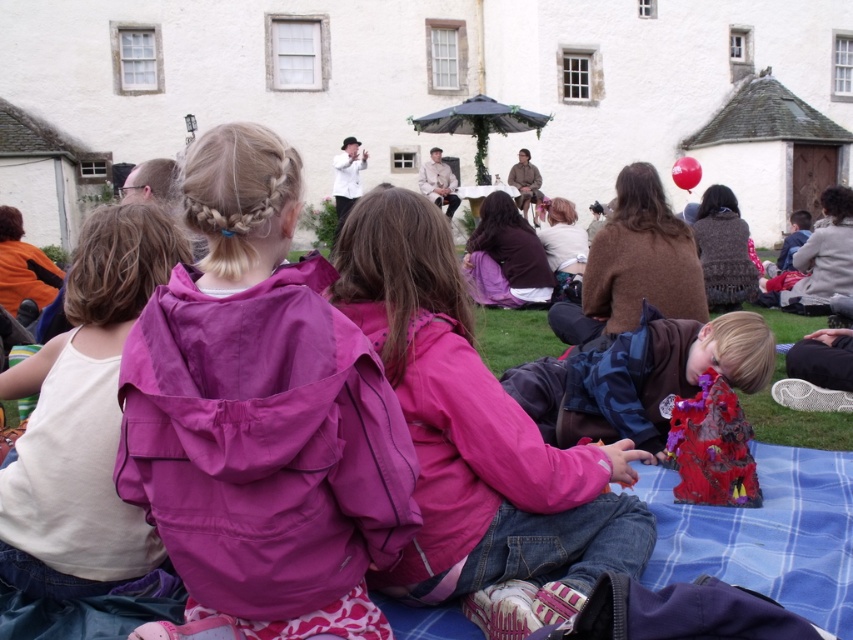
Is point (62, 593) closer to viewer compared to point (666, 452)?

Yes.

Is white fabric shirt at left taller than shiny plastic toy at lower right?

In fact, white fabric shirt at left may be shorter than shiny plastic toy at lower right.

This screenshot has width=853, height=640. What do you see at coordinates (83, 419) in the screenshot?
I see `white fabric shirt at left` at bounding box center [83, 419].

Identify the location of white fabric shirt at left. This screenshot has width=853, height=640. (83, 419).

Is purple fabric jacket at center wider than white fabric shirt at left?

Yes, purple fabric jacket at center is wider than white fabric shirt at left.

Does purple fabric jacket at center have a greater height compared to white fabric shirt at left?

Incorrect, purple fabric jacket at center's height is not larger of white fabric shirt at left's.

Between point (230, 476) and point (112, 260), which one is positioned behind?

Point (112, 260)

I want to click on purple fabric jacket at center, so click(260, 417).

Is pink fabric jacket at center bigger than dark blue fabric at lower right?

Incorrect, pink fabric jacket at center is not larger than dark blue fabric at lower right.

Is pink fabric jacket at center wider than dark blue fabric at lower right?

No.

Who is more distant from viewer, (440, 397) or (578, 355)?

Positioned behind is point (578, 355).

This screenshot has width=853, height=640. I want to click on pink fabric jacket at center, so click(x=476, y=435).